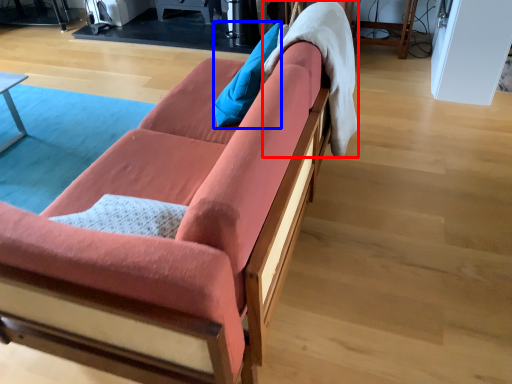
Question: Among these objects, which one is nearest to the camera, blanket (highlighted by a red box) or pillow (highlighted by a blue box)?

Choices:
 (A) blanket
 (B) pillow

Answer: (A)